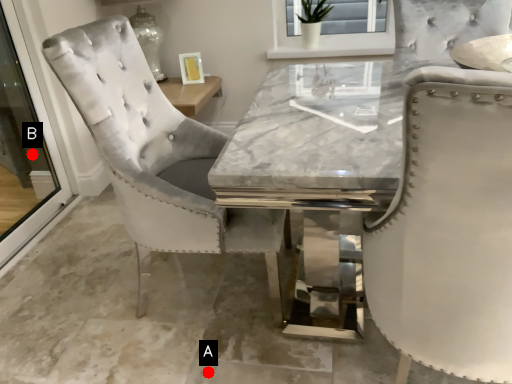
Question: Two points are circled on the image, labeled by A and B beside each circle. Among these points, which one is nearest to the camera?

Choices:
 (A) A is closer
 (B) B is closer

Answer: (A)